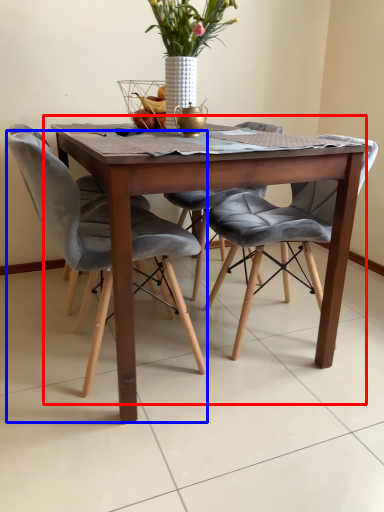
Question: Which point is further to the camera, kitchen & dining room table (highlighted by a red box) or chair (highlighted by a blue box)?

Choices:
 (A) kitchen & dining room table
 (B) chair

Answer: (B)